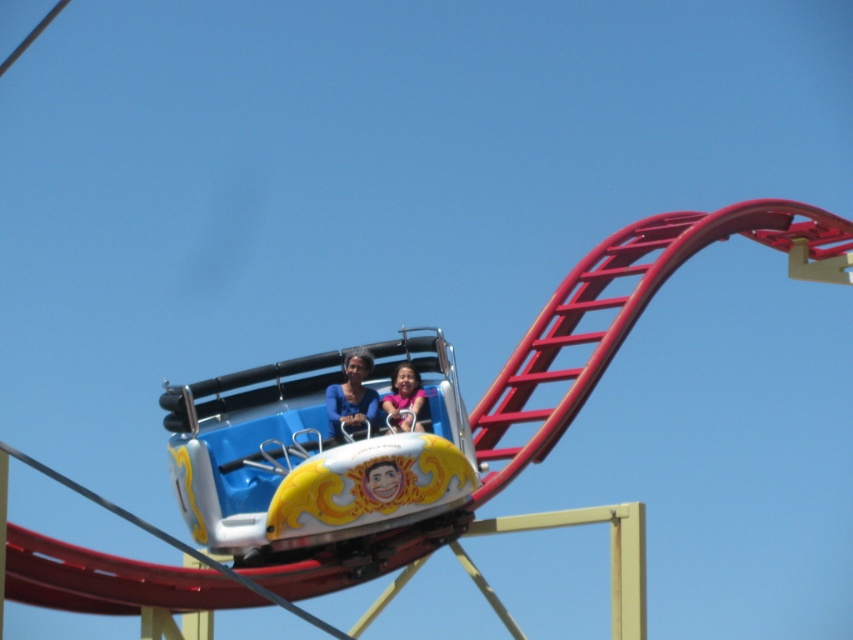
Is matte blue shirt at center below matte pink shirt at center?

Incorrect, matte blue shirt at center is not positioned below matte pink shirt at center.

How distant is matte blue shirt at center from matte pink shirt at center?

1.36 meters

What do you see at coordinates (352, 396) in the screenshot? Image resolution: width=853 pixels, height=640 pixels. I see `matte blue shirt at center` at bounding box center [352, 396].

Locate an element on the screen. matte blue shirt at center is located at coordinates (352, 396).

Between metallic blue roller coaster car at center and matte blue shirt at center, which one appears on the left side from the viewer's perspective?

Positioned to the left is matte blue shirt at center.

Which is above, metallic blue roller coaster car at center or matte blue shirt at center?

Positioned higher is matte blue shirt at center.

Image resolution: width=853 pixels, height=640 pixels. What do you see at coordinates (311, 456) in the screenshot?
I see `metallic blue roller coaster car at center` at bounding box center [311, 456].

Find the location of a particular element. metallic blue roller coaster car at center is located at coordinates (311, 456).

Which of these two, metallic blue roller coaster car at center or matte pink shirt at center, stands shorter?

Standing shorter between the two is matte pink shirt at center.

Locate an element on the screen. metallic blue roller coaster car at center is located at coordinates (311, 456).

Where is `metallic blue roller coaster car at center`? Image resolution: width=853 pixels, height=640 pixels. metallic blue roller coaster car at center is located at coordinates (311, 456).